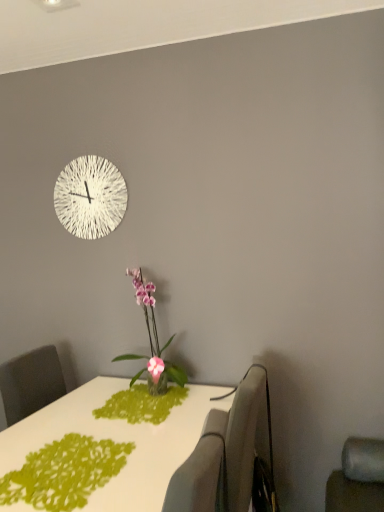
Where is `unoccupied space behind green paper doily at lower left`? The width and height of the screenshot is (384, 512). unoccupied space behind green paper doily at lower left is located at coordinates (84, 422).